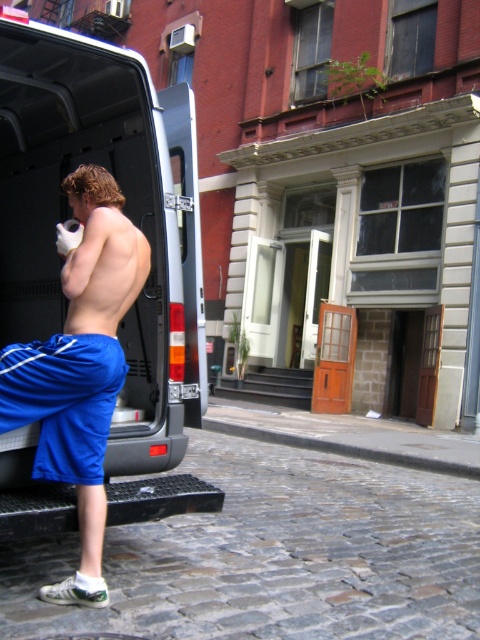
You are a delivery person who needs to load a package into the white matte van at center. You are currently standing next to the blue fabric shorts at lower left. Can you reach the van door without climbing?

The white matte van at center is much taller than the blue fabric shorts at lower left, so you may need to climb or use a step to reach the van door.

You are a delivery driver who needs to park the van in a specific spot. The parking spot has coordinates marked at point 0.331, 0.258. Can you determine if the white matte van at center is already parked in the correct spot based on its current position?

The white matte van at center is located at point (123, 211), so yes, it is parked in the correct spot with the specified coordinates.

In the scene shown: You are a photographer trying to capture a photo of the blue fabric shorts at center and the blue fabric shorts at lower left. Which of the two blue fabric shorts is located to the right when viewed from the front?

The blue fabric shorts at center is positioned on the right side of blue fabric shorts at lower left, so the blue fabric shorts at center is located to the right when viewed from the front.